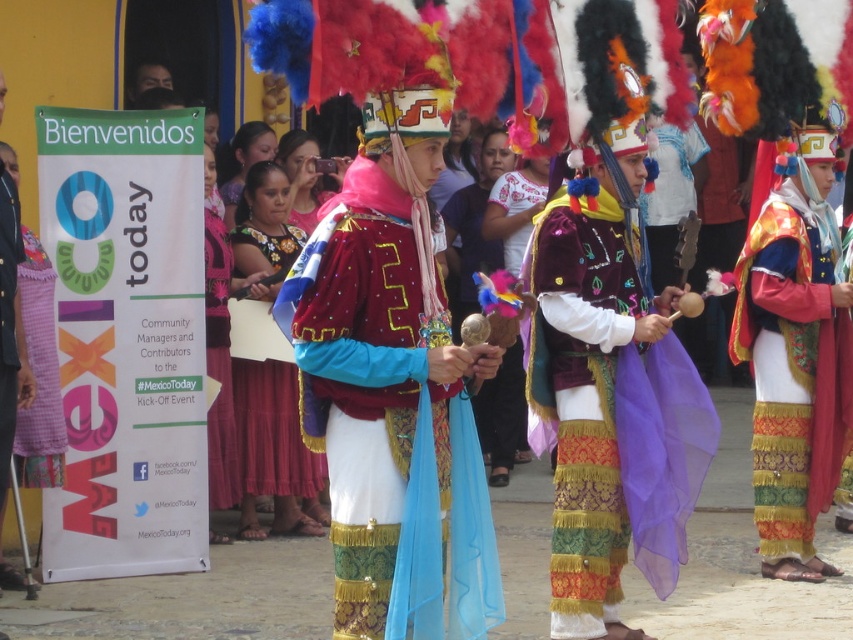
You are a photographer at the event and want to capture the pink checkered fabric at left. Where should you position your camera to ensure it is in the frame?

The pink checkered fabric at left is located at point (x=39, y=372), so position your camera to include that coordinate in the frame.

You are a photographer at this event and want to capture both the embroidered silk skirt at right and the matte pink fabric at center in a single shot. Since you need to frame them properly, can you tell me which one is positioned more to the right side of the scene?

The embroidered silk skirt at right is positioned more to the right than the matte pink fabric at center.